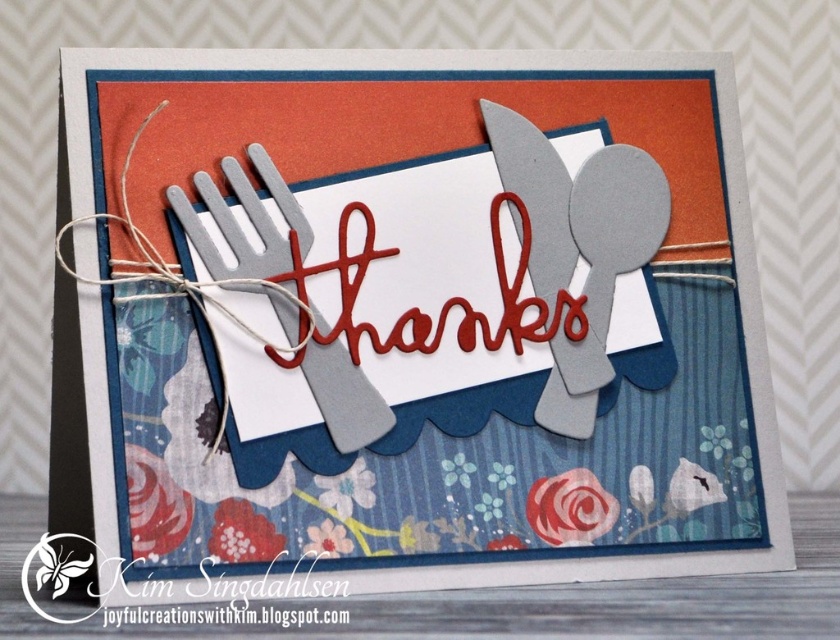
Consider the image. You are designing a greeting card and want to ensure that the matte gray utensils at center and the matte gray fork at center are positioned correctly. Based on the card design, which of these two items is taller?

The matte gray utensils at center is much taller than the matte gray fork at center.

You are designing a greeting card and want to ensure the matte gray utensils at center and the metallic silver spoon at upper right are arranged properly. Based on the card design, which object is placed above the other?

The metallic silver spoon at upper right is positioned above the matte gray utensils at center.